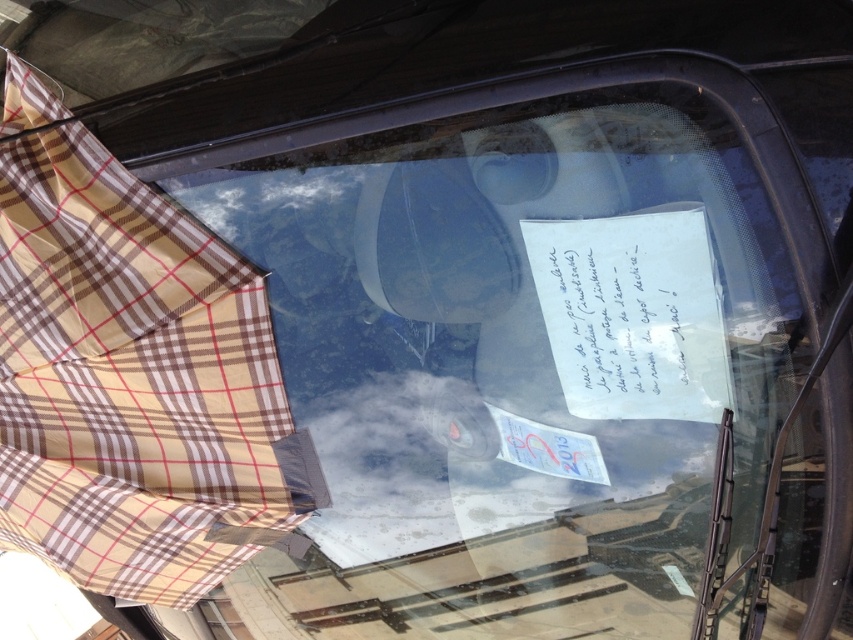
You are a pedestrian standing in front of the car with the windshield covered by a plaid fabric. You see the point marked at coordinates (134, 384). What object is located at that point?

The point at coordinates (134, 384) corresponds to the brown plaid umbrella at left.

You are a delivery person who needs to check the note on the windshield. The brown plaid umbrella at left and the white paper at center are in your way. Which object should you move first to access the note?

The brown plaid umbrella at left is positioned under the white paper at center. To access the note, you should move the brown plaid umbrella at left first because it is underneath the white paper, so moving it first will allow you to reach the note without disturbing the white paper.